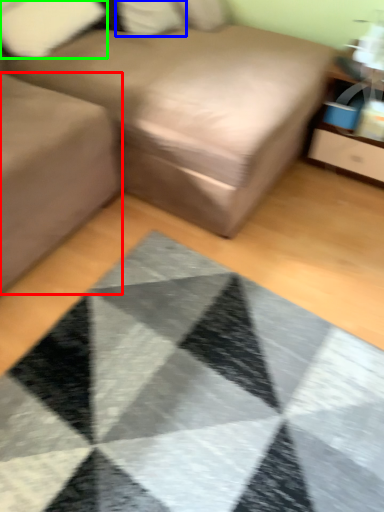
Question: Based on their relative distances, which object is farther from gray (highlighted by a red box)? Choose from pillow (highlighted by a blue box) and pillow (highlighted by a green box).

Choices:
 (A) pillow
 (B) pillow

Answer: (A)